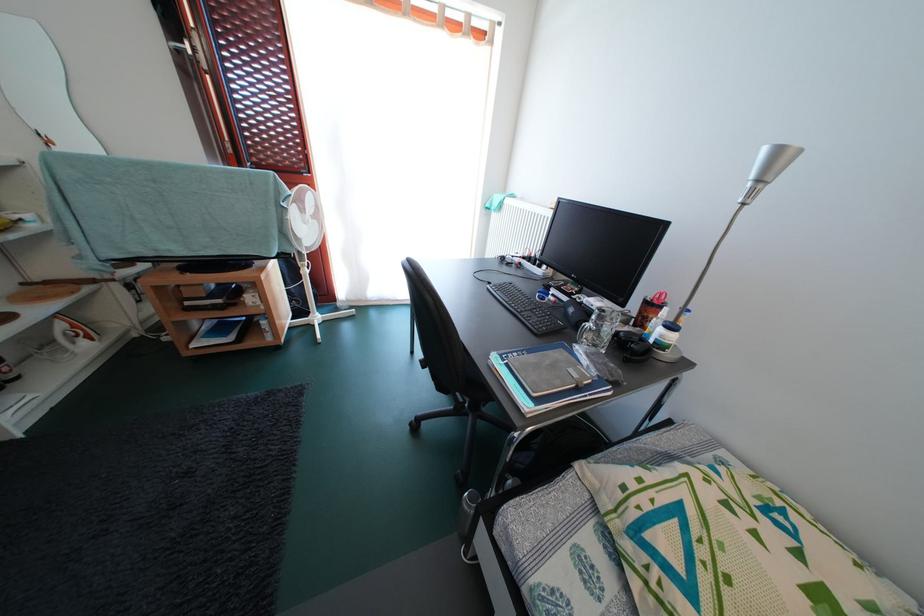
The location [599,328] corresponds to which object?

This point indicates the metal water bottle.